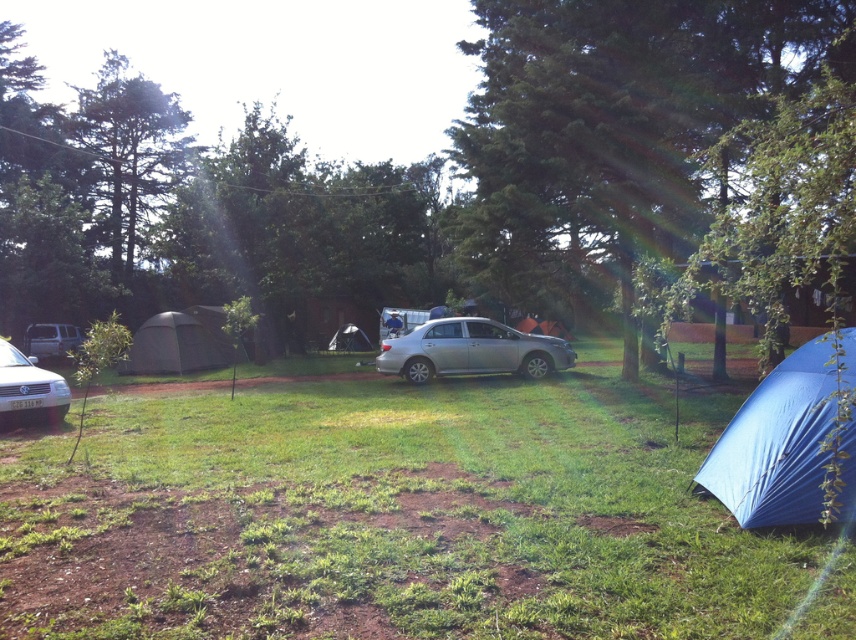
You are planning to set up a satellite dish that requires a clear vertical space of at least 2 meters. Given the dark green fabric tent at lower left and the blue tarpaulin tent at center, which tent would be more suitable for placing the satellite dish near?

The dark green fabric tent at lower left is taller than the blue tarpaulin tent at center, so it would provide the necessary vertical clearance for the satellite dish.

You are setting up a picnic area and need to access both the dark green fabric tent at lower left and the blue tarpaulin tent at center. Which tent should you approach first to avoid walking through the other one?

You should approach the dark green fabric tent at lower left first because it is in front of the blue tarpaulin tent at center, so reaching it first won

You are a hiker who needs to set up a new tent. You see the blue tarpaulin tent at lower right and the metallic silver van at left. Which object is located to the right of the other?

The blue tarpaulin tent at lower right is positioned on the right side of metallic silver van at left.